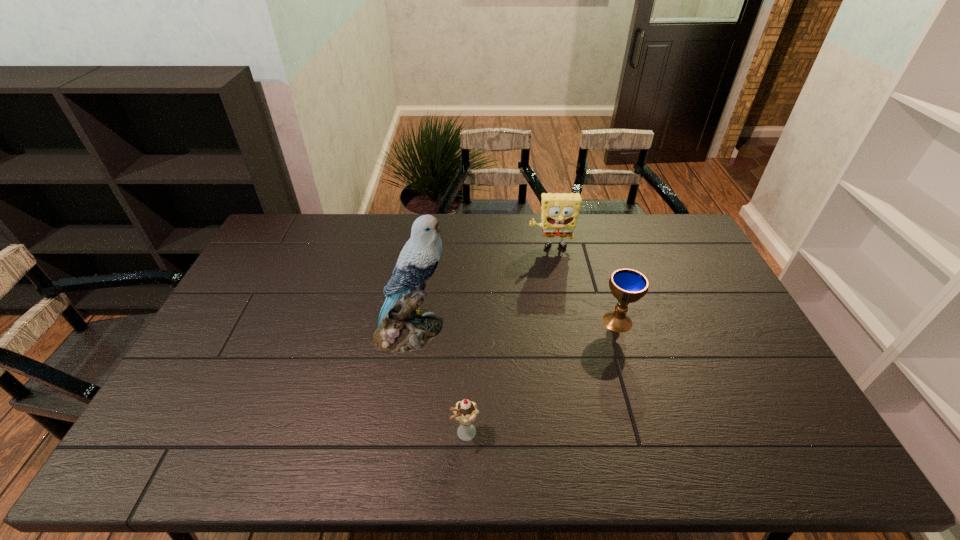
Locate an element on the screen. This screenshot has width=960, height=540. the closest object relative to the third shortest object is located at coordinates (627, 285).

Identify the location of the third closest object to the farthest object. The image size is (960, 540). (465, 412).

Identify the location of vacant space that satisfies the following two spatial constraints: 1. on the face of the third object from right to left; 2. on the right side of the tallest object. (396, 434).

This screenshot has width=960, height=540. Identify the location of vacant space that satisfies the following two spatial constraints: 1. on the back side of the second object from left to right; 2. on the face of the tallest object. (468, 330).

What are the coordinates of `vacant space that satisfies the following two spatial constraints: 1. on the face of the second tallest object; 2. on the face of the leftmost object` in the screenshot? It's located at (566, 330).

At what (x,y) coordinates should I click in order to perform the action: click on free spot that satisfies the following two spatial constraints: 1. on the face of the third shortest object; 2. on the face of the leftmost object. Please return your answer as a coordinate pair (x, y). The height and width of the screenshot is (540, 960). Looking at the image, I should click on (566, 330).

Where is `free space that satisfies the following two spatial constraints: 1. on the face of the parakeet; 2. on the right side of the third object from right to left`? The image size is (960, 540). free space that satisfies the following two spatial constraints: 1. on the face of the parakeet; 2. on the right side of the third object from right to left is located at coordinates (396, 434).

Find the location of a particular element. This screenshot has width=960, height=540. blank area in the image that satisfies the following two spatial constraints: 1. on the front side of the chalice; 2. on the face of the tallest object is located at coordinates (620, 330).

Where is `vacant space that satisfies the following two spatial constraints: 1. on the face of the sponge; 2. on the face of the parakeet`? The image size is (960, 540). vacant space that satisfies the following two spatial constraints: 1. on the face of the sponge; 2. on the face of the parakeet is located at coordinates (566, 330).

I want to click on vacant space that satisfies the following two spatial constraints: 1. on the face of the third shortest object; 2. on the face of the leftmost object, so (566, 330).